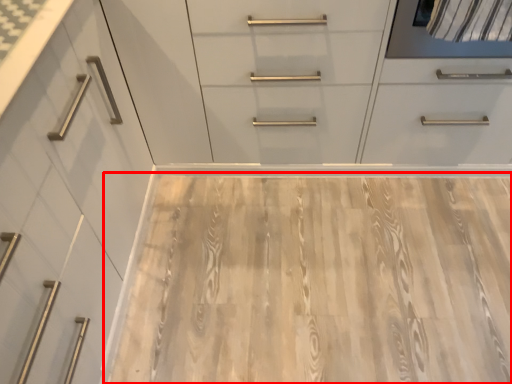
Question: From the image's perspective, considering the relative positions of plywood (annotated by the red box) and dresser in the image provided, where is plywood (annotated by the red box) located with respect to the staircase?

Choices:
 (A) below
 (B) above

Answer: (A)